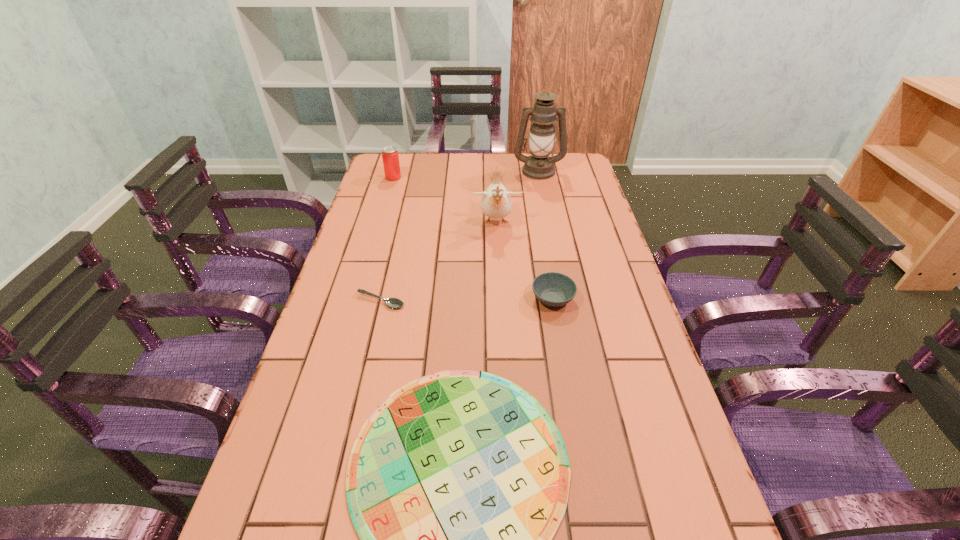
The width and height of the screenshot is (960, 540). Find the location of `vacant region located on the back of the fifth tallest object`. vacant region located on the back of the fifth tallest object is located at coordinates (395, 240).

Find the location of a particular element. oil lamp positioned at the far edge is located at coordinates (538, 165).

At what (x,y) coordinates should I click in order to perform the action: click on can present at the far edge. Please return your answer as a coordinate pair (x, y). Looking at the image, I should click on (390, 157).

The image size is (960, 540). Identify the location of can located in the left edge section of the desktop. (390, 157).

This screenshot has height=540, width=960. In order to click on soupspoon that is positioned at the left edge in this screenshot , I will do `click(390, 302)`.

The width and height of the screenshot is (960, 540). Find the location of `oil lamp present at the right edge`. oil lamp present at the right edge is located at coordinates (538, 165).

Find the location of a particular element. This screenshot has height=540, width=960. soup bowl present at the right edge is located at coordinates (553, 289).

I want to click on object at the far left corner, so click(390, 157).

Image resolution: width=960 pixels, height=540 pixels. What are the coordinates of `object that is positioned at the far right corner` in the screenshot? It's located at point(538,165).

Image resolution: width=960 pixels, height=540 pixels. I want to click on vacant region at the far edge of the desktop, so click(x=448, y=164).